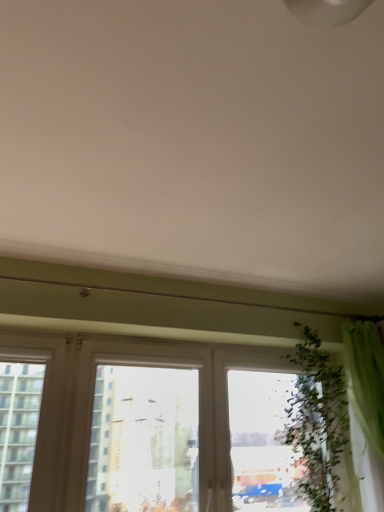
The height and width of the screenshot is (512, 384). I want to click on transparent glass window at center, so click(x=140, y=426).

This screenshot has width=384, height=512. What do you see at coordinates (366, 409) in the screenshot? I see `green fabric curtain at right` at bounding box center [366, 409].

Find the location of `green leafy plant at right`. green leafy plant at right is located at coordinates (317, 422).

This screenshot has height=512, width=384. I want to click on curtain on the right of green leafy plant at right, so click(x=366, y=409).

Is green fabric curtain at right aimed at green leafy plant at right?

No, green fabric curtain at right is not facing towards green leafy plant at right.

Considering the sizes of green fabric curtain at right and green leafy plant at right in the image, is green fabric curtain at right bigger or smaller than green leafy plant at right?

Clearly, green fabric curtain at right is larger in size than green leafy plant at right.

Consider the image. Measure the distance from green fabric curtain at right to green leafy plant at right.

green fabric curtain at right is 7.91 inches from green leafy plant at right.

How much distance is there between green fabric curtain at right and transparent glass window at center?

green fabric curtain at right is 36.17 inches from transparent glass window at center.

Which point is more forward, (380, 509) or (278, 447)?

The point (380, 509) is more forward.

In the image, is green fabric curtain at right positioned in front of or behind transparent glass window at center?

Visually, green fabric curtain at right is located behind transparent glass window at center.

Would you say green fabric curtain at right is to the left or to the right of transparent glass window at center in the picture?

From the image, it's evident that green fabric curtain at right is to the right of transparent glass window at center.

Are green leafy plant at right and transparent glass window at center beside each other?

No, green leafy plant at right is not with transparent glass window at center.

From a real-world perspective, which is physically below, green leafy plant at right or transparent glass window at center?

From a 3D spatial view, transparent glass window at center is below.

What's the angular difference between green leafy plant at right and transparent glass window at center's facing directions?

2.8 degrees.

Considering the relative positions of green leafy plant at right and green fabric curtain at right in the image provided, is green leafy plant at right to the right of green fabric curtain at right from the viewer's perspective?

No, green leafy plant at right is not to the right of green fabric curtain at right.

Between point (300, 435) and point (348, 384), which one is positioned behind?

Positioned behind is point (300, 435).

Which object is closer to the camera taking this photo, green leafy plant at right or green fabric curtain at right?

green fabric curtain at right is closer to the camera.

You are a GUI agent. You are given a task and a screenshot of the screen. Output one action in this format:
    pyautogui.click(x=<x>, y=<y>)
    Task: Click on the vegetation located below the green fabric curtain at right (from the image's perspective)
    This screenshot has width=384, height=512.
    Given the screenshot: What is the action you would take?
    pyautogui.click(x=317, y=422)

Is transparent glass window at center turned away from green fabric curtain at right?

No.

Is transparent glass window at center thinner than green fabric curtain at right?

Yes.

From a real-world perspective, is transparent glass window at center positioned under green fabric curtain at right based on gravity?

Yes, from a real-world perspective, transparent glass window at center is under green fabric curtain at right.

Identify the location of window on the left of green fabric curtain at right. (140, 426).

From a real-world perspective, is transparent glass window at center positioned above or below green leafy plant at right?

transparent glass window at center is situated lower than green leafy plant at right in the real world.

Is point (61, 485) closer to viewer compared to point (322, 370)?

That is True.

Is transparent glass window at center in contact with green leafy plant at right?

No, transparent glass window at center is not next to green leafy plant at right.

Which object is further away from the camera taking this photo, transparent glass window at center or green leafy plant at right?

Positioned behind is green leafy plant at right.

Where is `curtain above the green leafy plant at right (from the image's perspective)`? Image resolution: width=384 pixels, height=512 pixels. curtain above the green leafy plant at right (from the image's perspective) is located at coordinates (366, 409).

The width and height of the screenshot is (384, 512). I want to click on curtain behind the transparent glass window at center, so click(x=366, y=409).

Which object lies further to the anchor point green fabric curtain at right, transparent glass window at center or green leafy plant at right?

transparent glass window at center is further to green fabric curtain at right.

From the image, which object appears to be farther from green leafy plant at right, green fabric curtain at right or transparent glass window at center?

The object further to green leafy plant at right is transparent glass window at center.

Considering their positions, is green leafy plant at right positioned closer to transparent glass window at center than green fabric curtain at right?

green leafy plant at right is closer to transparent glass window at center.

Looking at the image, which one is located further to green leafy plant at right, transparent glass window at center or green fabric curtain at right?

transparent glass window at center lies further to green leafy plant at right than the other object.

From the image, which object appears to be farther from transparent glass window at center, green fabric curtain at right or green leafy plant at right?

green fabric curtain at right.

Looking at the image, which one is located further to green fabric curtain at right, green leafy plant at right or transparent glass window at center?

The object further to green fabric curtain at right is transparent glass window at center.

In order to click on vegetation situated between transparent glass window at center and green fabric curtain at right from left to right in this screenshot , I will do `click(317, 422)`.